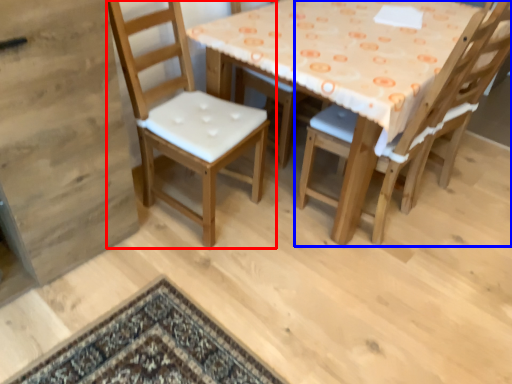
Question: Which point is closer to the camera, chair (highlighted by a red box) or chair (highlighted by a blue box)?

Choices:
 (A) chair
 (B) chair

Answer: (A)